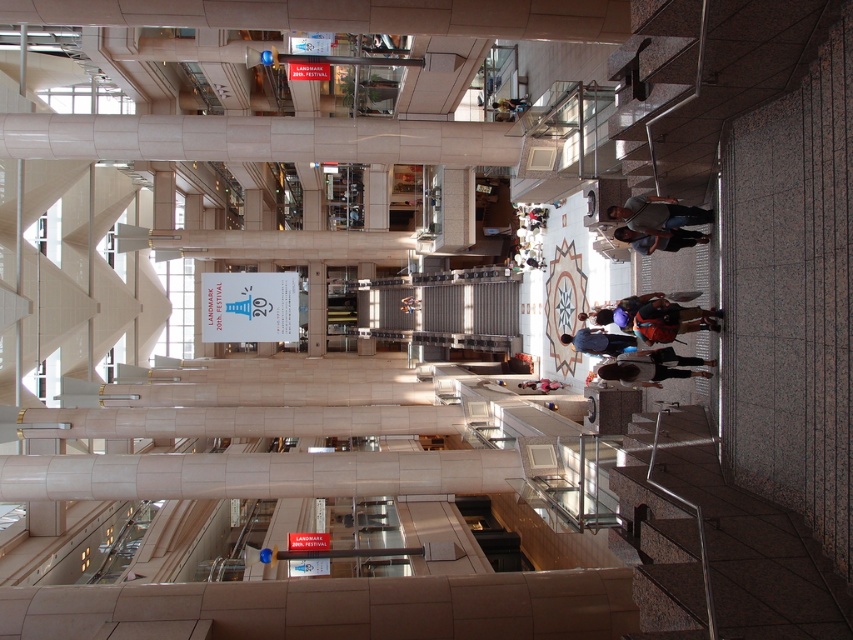
Question: Does dark gray shirt at right appear on the right side of dark blue jeans at center?

Choices:
 (A) no
 (B) yes

Answer: (A)

Question: Which point is farther to the camera?

Choices:
 (A) orange fabric backpack at center
 (B) dark gray shirt at right
 (C) matte black backpack at center
 (D) dark blue shirt at right

Answer: (C)

Question: Which object is closer to the camera taking this photo?

Choices:
 (A) dark blue jeans at center
 (B) matte black backpack at center

Answer: (A)

Question: Is dark gray shirt at right wider than orange fabric bag at center?

Choices:
 (A) no
 (B) yes

Answer: (A)

Question: Which object is the farthest from the orange fabric backpack at center?

Choices:
 (A) matte black backpack at center
 (B) dark blue jeans at center
 (C) dark gray shirt at right

Answer: (A)

Question: Can you confirm if dark gray shirt at right is wider than dark blue jeans at center?

Choices:
 (A) yes
 (B) no

Answer: (B)